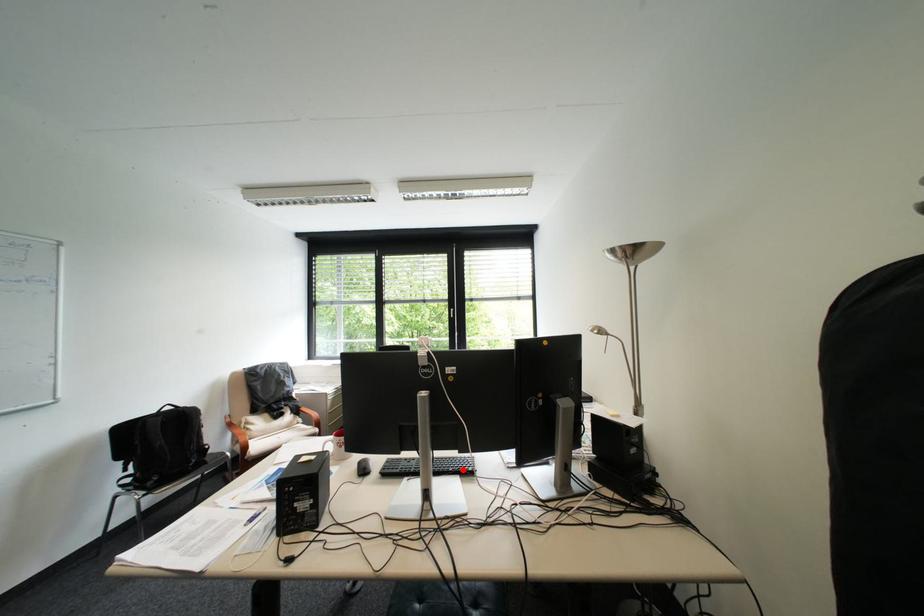
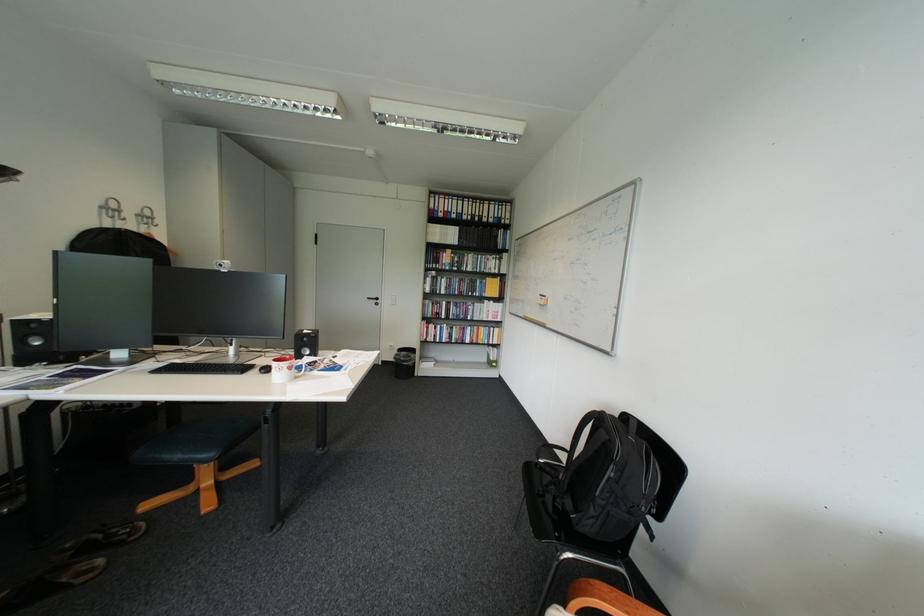
In the second image, find the point that corresponds to the highlighted location in the first image.

(205, 363)